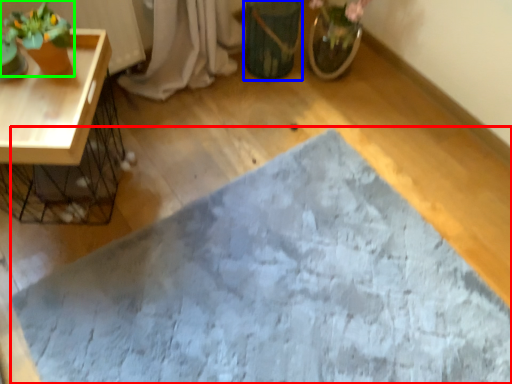
Question: Which object is the farthest from bath mat (highlighted by a red box)? Choose among these: flowerpot (highlighted by a blue box) or houseplant (highlighted by a green box).

Choices:
 (A) flowerpot
 (B) houseplant

Answer: (B)